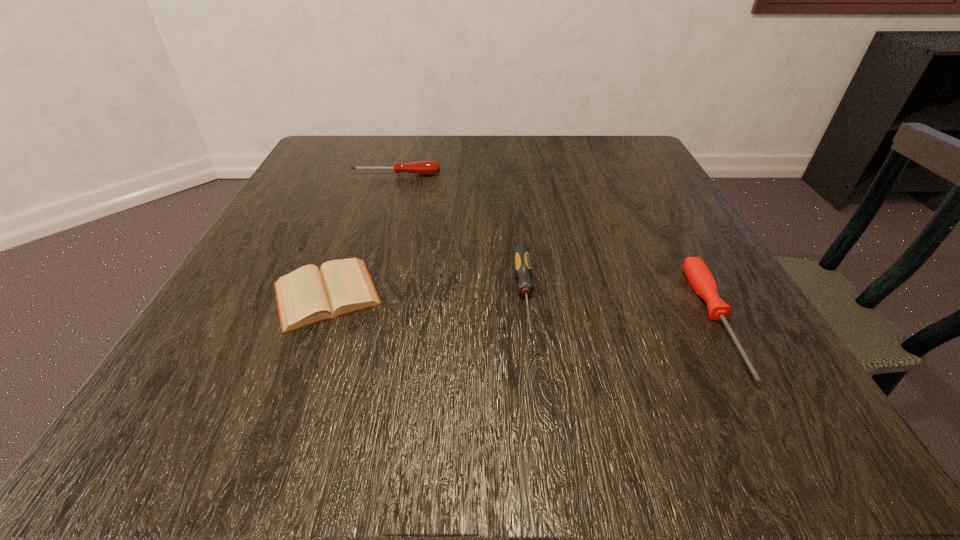
Image resolution: width=960 pixels, height=540 pixels. I want to click on screwdriver present at the left edge, so click(421, 167).

Locate an element on the screen. diary located in the left edge section of the desktop is located at coordinates (308, 295).

This screenshot has width=960, height=540. What are the coordinates of `object that is at the right edge` in the screenshot? It's located at (700, 278).

In order to click on object present at the far left corner in this screenshot , I will do `click(421, 167)`.

I want to click on object that is at the near right corner, so click(x=700, y=278).

In the image, there is a desktop. Where is `vacant area at the far edge`? vacant area at the far edge is located at coordinates (384, 179).

Find the location of a particular element. Image resolution: width=960 pixels, height=540 pixels. free space at the near edge of the desktop is located at coordinates (394, 440).

The width and height of the screenshot is (960, 540). What are the coordinates of `vacant area at the left edge` in the screenshot? It's located at (241, 356).

This screenshot has width=960, height=540. Find the location of `vacant space at the right edge of the desktop`. vacant space at the right edge of the desktop is located at coordinates (735, 294).

Where is `vacant area at the far left corner of the desktop`? The width and height of the screenshot is (960, 540). vacant area at the far left corner of the desktop is located at coordinates (370, 173).